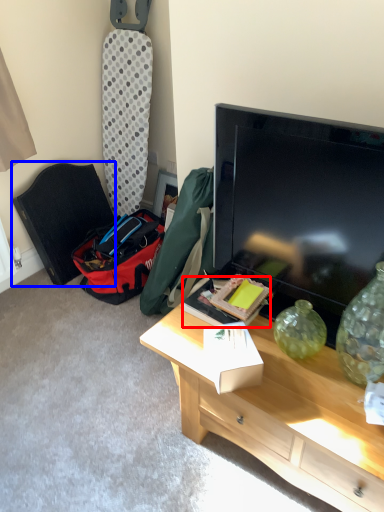
Question: Which object appears closest to the camera in this image, box (highlighted by a red box) or folding chair (highlighted by a blue box)?

Choices:
 (A) box
 (B) folding chair

Answer: (A)